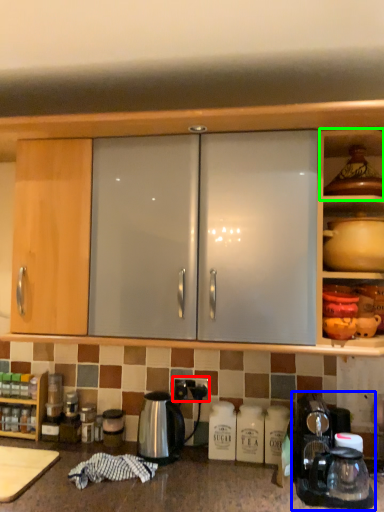
Question: Based on their relative distances, which object is nearer to electric outlet (highlighted by a red box)? Choose from coffee machine (highlighted by a blue box) and shelf (highlighted by a green box).

Choices:
 (A) coffee machine
 (B) shelf

Answer: (A)